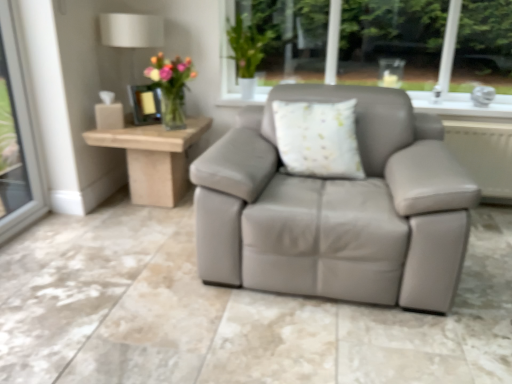
Question: Is light wood/roughobject at left at the right side of translucent glass vase at upper left?

Choices:
 (A) yes
 (B) no

Answer: (B)

Question: Is light wood/roughobject at left touching translucent glass vase at upper left?

Choices:
 (A) no
 (B) yes

Answer: (A)

Question: From a real-world perspective, is light wood/roughobject at left on top of translucent glass vase at upper left?

Choices:
 (A) yes
 (B) no

Answer: (B)

Question: Can you confirm if light wood/roughobject at left is positioned to the left of translucent glass vase at upper left?

Choices:
 (A) no
 (B) yes

Answer: (B)

Question: Does light wood/roughobject at left have a greater height compared to translucent glass vase at upper left?

Choices:
 (A) no
 (B) yes

Answer: (B)

Question: Is metallic lampshade at upper left to the left or to the right of translucent glass vase at upper left in the image?

Choices:
 (A) left
 (B) right

Answer: (A)

Question: Considering the positions of metallic lampshade at upper left and translucent glass vase at upper left in the image, is metallic lampshade at upper left bigger or smaller than translucent glass vase at upper left?

Choices:
 (A) big
 (B) small

Answer: (A)

Question: In terms of height, does metallic lampshade at upper left look taller or shorter compared to translucent glass vase at upper left?

Choices:
 (A) short
 (B) tall

Answer: (B)

Question: From the image's perspective, is metallic lampshade at upper left above or below translucent glass vase at upper left?

Choices:
 (A) below
 (B) above

Answer: (B)

Question: Relative to metallic lampshade at upper left, is translucent glass vase at upper left in front or behind?

Choices:
 (A) behind
 (B) front

Answer: (B)

Question: Considering the relative positions of translucent glass vase at upper left and metallic lampshade at upper left in the image provided, is translucent glass vase at upper left to the left or to the right of metallic lampshade at upper left?

Choices:
 (A) right
 (B) left

Answer: (A)

Question: In terms of height, does translucent glass vase at upper left look taller or shorter compared to metallic lampshade at upper left?

Choices:
 (A) short
 (B) tall

Answer: (A)

Question: Is translucent glass vase at upper left wider or thinner than metallic lampshade at upper left?

Choices:
 (A) wide
 (B) thin

Answer: (B)

Question: In terms of width, does light wood/roughobject at left look wider or thinner when compared to translucent glass vase at upper left?

Choices:
 (A) wide
 (B) thin

Answer: (A)

Question: Considering their positions, is light wood/roughobject at left located in front of or behind translucent glass vase at upper left?

Choices:
 (A) front
 (B) behind

Answer: (B)